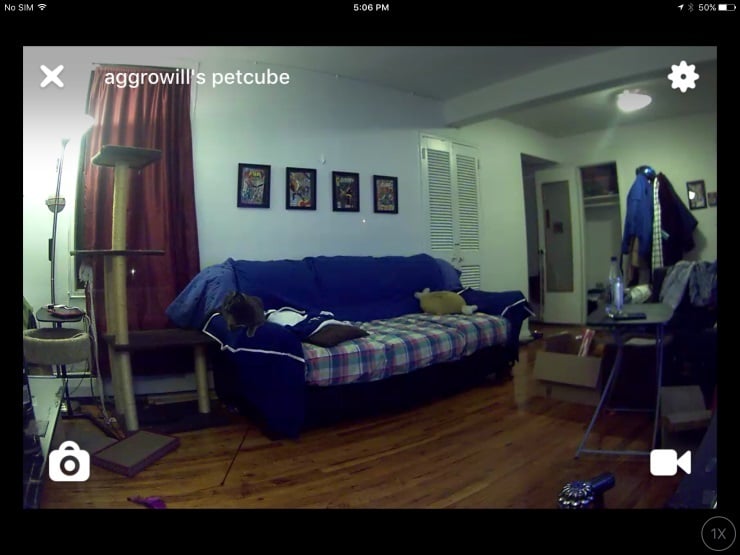
Identify the location of blue couch. The height and width of the screenshot is (555, 740). (269, 267), (434, 254), (288, 397), (525, 362).